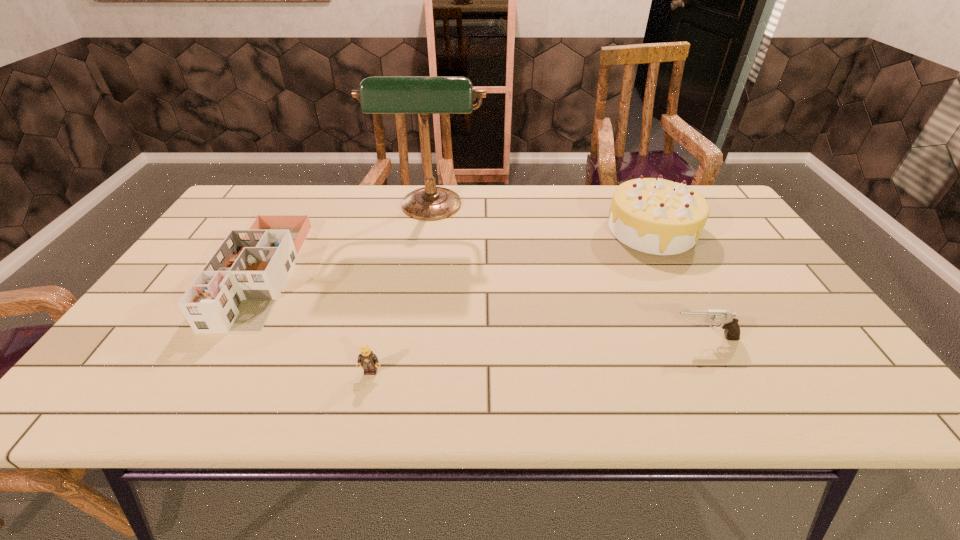
Where is `empty location between the table lamp and the second tallest object`? empty location between the table lamp and the second tallest object is located at coordinates (541, 220).

Find the location of a particular element. unoccupied position between the table lamp and the fourth shortest object is located at coordinates (541, 220).

Where is `free spot between the tallest object and the gun`? The image size is (960, 540). free spot between the tallest object and the gun is located at coordinates (567, 273).

Locate an element on the screen. The height and width of the screenshot is (540, 960). vacant point located between the birthday cake and the leftmost object is located at coordinates (457, 252).

Identify which object is the third nearest to the nearest object. Please provide its 2D coordinates. Your answer should be formatted as a tuple, i.e. [(x, y)], where the tuple contains the x and y coordinates of a point satisfying the conditions above.

[(729, 322)]

The image size is (960, 540). In order to click on object that ranks as the closest to the dollhouse in this screenshot , I will do `click(424, 95)`.

Where is `vacant region that satisfies the following two spatial constraints: 1. at the muzzle of the gun; 2. in front of the Lego`? This screenshot has width=960, height=540. vacant region that satisfies the following two spatial constraints: 1. at the muzzle of the gun; 2. in front of the Lego is located at coordinates (721, 372).

The height and width of the screenshot is (540, 960). Identify the location of vacant space that satisfies the following two spatial constraints: 1. at the muzzle of the second nearest object; 2. in front of the nearest object. (721, 372).